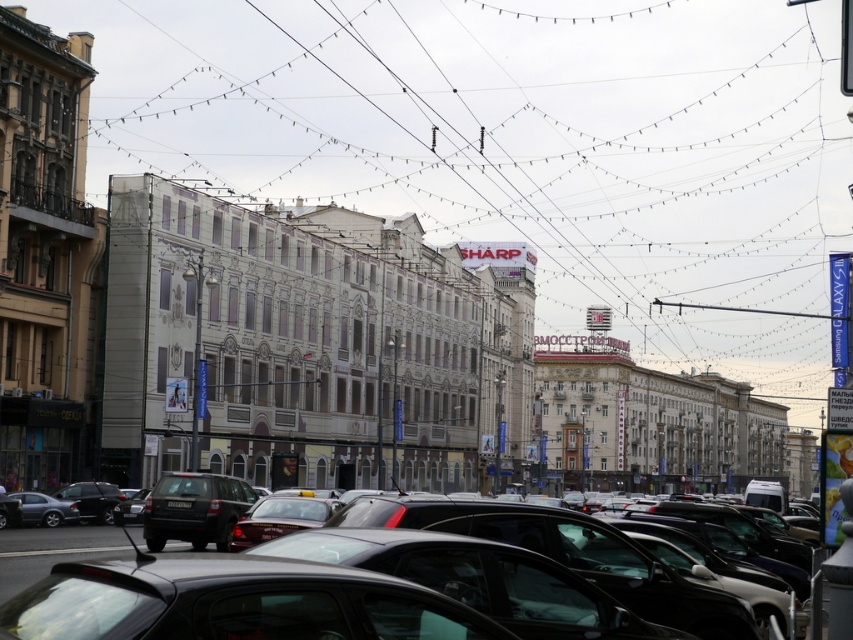
Is metallic wire at upper center to the right of matte black suv at center from the viewer's perspective?

Indeed, metallic wire at upper center is positioned on the right side of matte black suv at center.

Does metallic wire at upper center have a lesser width compared to matte black suv at center?

No.

Who is more distant from viewer, (x=555, y=289) or (x=152, y=548)?

Positioned behind is point (x=555, y=289).

The height and width of the screenshot is (640, 853). I want to click on metallic wire at upper center, so click(526, 144).

Does metallic wire at upper center appear on the left side of black plastic license plate at center?

No, metallic wire at upper center is not to the left of black plastic license plate at center.

The height and width of the screenshot is (640, 853). In order to click on metallic wire at upper center in this screenshot , I will do `click(526, 144)`.

The image size is (853, 640). In order to click on metallic wire at upper center in this screenshot , I will do `click(526, 144)`.

Is matte black suv at center closer to the viewer compared to black plastic license plate at center?

Yes, matte black suv at center is in front of black plastic license plate at center.

Is point (231, 513) in front of point (181, 502)?

Yes, point (231, 513) is closer to viewer.

The image size is (853, 640). What are the coordinates of `matte black suv at center` in the screenshot? It's located at [195, 509].